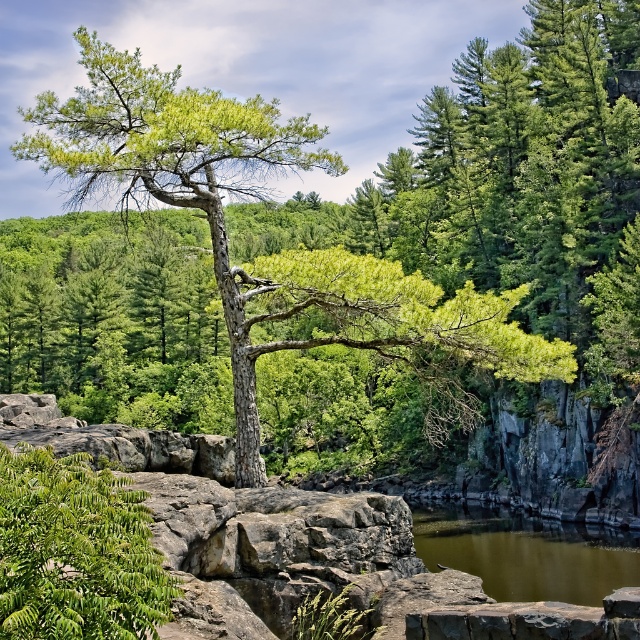
Based on the photo, you are standing at the origin point in the image and want to locate the green textured tree at center. In which direction should you move to reach it?

The green textured tree at center is located at point 0.300 on the x axis and 0.309 on the y axis, so you should move northeast to reach it.